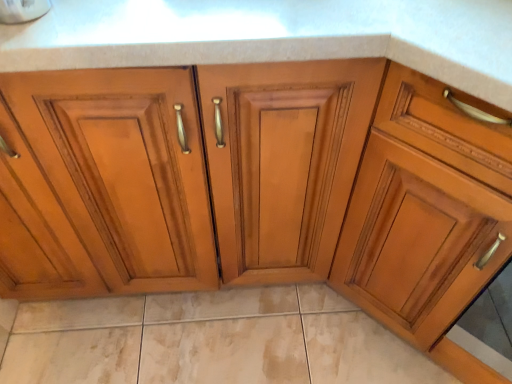
The height and width of the screenshot is (384, 512). Identify the location of vacant region above beige marble tile at lower center (from a real-world perspective). (228, 338).